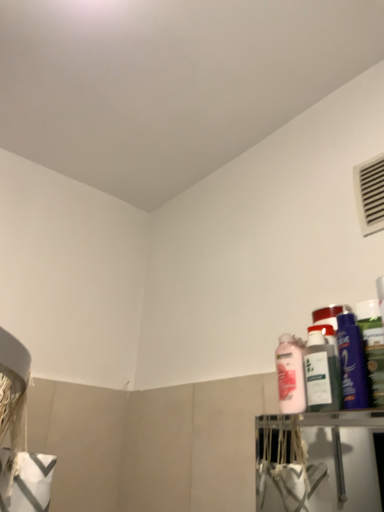
Question: Can you confirm if pink glossy lotion at right, positioned as the third cleaning product in right-to-left order, is smaller than shiny purple bottle at right, the 2th cleaning product from the right?

Choices:
 (A) yes
 (B) no

Answer: (A)

Question: Would you say pink glossy lotion at right, positioned as the third cleaning product in right-to-left order, is outside shiny purple bottle at right, the 2th cleaning product from the right?

Choices:
 (A) yes
 (B) no

Answer: (A)

Question: Is pink glossy lotion at right, marked as the first cleaning product in a left-to-right arrangement, at the right side of shiny purple bottle at right, the 2th cleaning product from the right?

Choices:
 (A) no
 (B) yes

Answer: (A)

Question: Considering the relative sizes of pink glossy lotion at right, positioned as the third cleaning product in right-to-left order, and shiny purple bottle at right, the 2th cleaning product from the right, in the image provided, is pink glossy lotion at right, positioned as the third cleaning product in right-to-left order, taller than shiny purple bottle at right, the 2th cleaning product from the right,?

Choices:
 (A) yes
 (B) no

Answer: (B)

Question: Is pink glossy lotion at right, marked as the first cleaning product in a left-to-right arrangement, aimed at shiny purple bottle at right, which is counted as the second cleaning product, starting from the left?

Choices:
 (A) no
 (B) yes

Answer: (A)

Question: Considering the positions of point (327, 409) and point (355, 188), is point (327, 409) closer or farther from the camera than point (355, 188)?

Choices:
 (A) farther
 (B) closer

Answer: (B)

Question: Looking at their shapes, would you say pink matte bottle at upper right is wider or thinner than white plastic air conditioning at upper right?

Choices:
 (A) thin
 (B) wide

Answer: (B)

Question: In the image, is pink matte bottle at upper right positioned in front of or behind white plastic air conditioning at upper right?

Choices:
 (A) behind
 (B) front

Answer: (B)

Question: Is pink matte bottle at upper right situated inside white plastic air conditioning at upper right or outside?

Choices:
 (A) inside
 (B) outside

Answer: (B)

Question: Is green matte bottle at right, which ranks as the 1th cleaning product in right-to-left order, inside or outside of pink glossy lotion at right, marked as the first cleaning product in a left-to-right arrangement?

Choices:
 (A) inside
 (B) outside

Answer: (B)

Question: From the image's perspective, is green matte bottle at right, which ranks as the third cleaning product in left-to-right order, positioned above or below pink glossy lotion at right, marked as the first cleaning product in a left-to-right arrangement?

Choices:
 (A) above
 (B) below

Answer: (A)

Question: Is green matte bottle at right, which ranks as the third cleaning product in left-to-right order, bigger or smaller than pink glossy lotion at right, marked as the first cleaning product in a left-to-right arrangement?

Choices:
 (A) big
 (B) small

Answer: (B)

Question: Considering the positions of point (375, 316) and point (284, 373), is point (375, 316) closer or farther from the camera than point (284, 373)?

Choices:
 (A) closer
 (B) farther

Answer: (A)

Question: Considering the positions of shiny purple bottle at right, the 2th cleaning product from the right, and white plastic air conditioning at upper right in the image, is shiny purple bottle at right, the 2th cleaning product from the right, wider or thinner than white plastic air conditioning at upper right?

Choices:
 (A) thin
 (B) wide

Answer: (B)

Question: From the image's perspective, is shiny purple bottle at right, which is counted as the second cleaning product, starting from the left, positioned above or below white plastic air conditioning at upper right?

Choices:
 (A) below
 (B) above

Answer: (A)